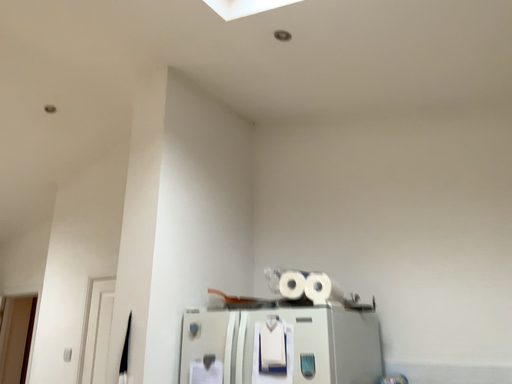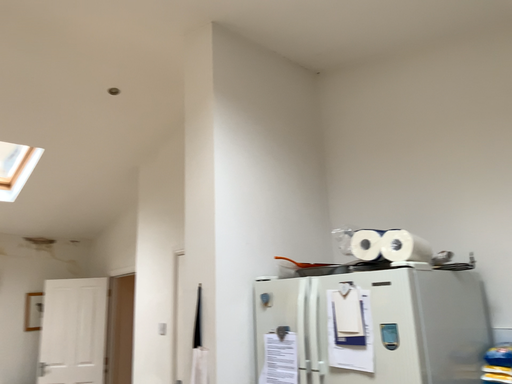
Question: How did the camera likely rotate when shooting the video?

Choices:
 (A) rotated left
 (B) rotated right

Answer: (A)